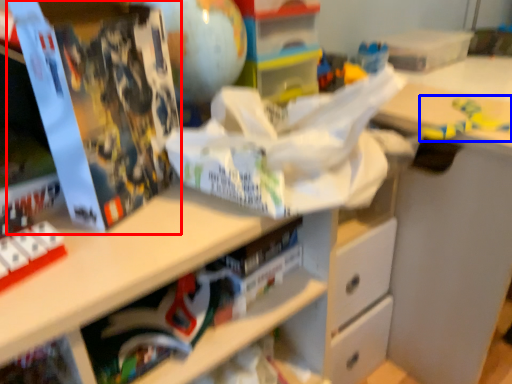
Question: Which point is further to the camera, paperback book (highlighted by a red box) or toy (highlighted by a blue box)?

Choices:
 (A) paperback book
 (B) toy

Answer: (B)